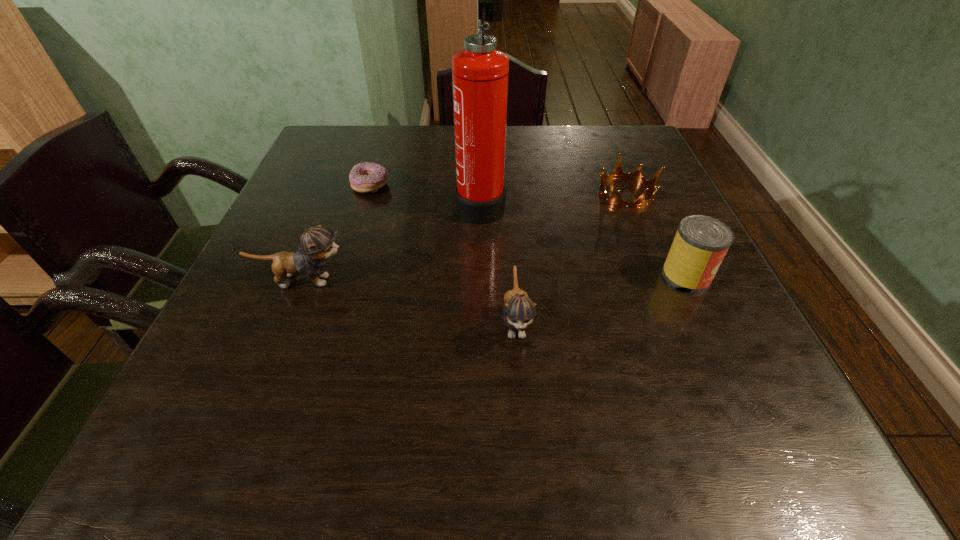
The width and height of the screenshot is (960, 540). Find the location of `vacant region located on the front-facing side of the tallest object`. vacant region located on the front-facing side of the tallest object is located at coordinates (396, 204).

Find the location of a particular element. Image resolution: width=960 pixels, height=540 pixels. free location located on the right of the shortest object is located at coordinates (492, 185).

Where is `vacant space located on the left of the can`? vacant space located on the left of the can is located at coordinates (638, 276).

The image size is (960, 540). What are the coordinates of `object that is positioned at the near edge` in the screenshot? It's located at (519, 310).

Where is `kitten at the left edge`? kitten at the left edge is located at coordinates (317, 244).

The width and height of the screenshot is (960, 540). Find the location of `doughnut positioned at the left edge`. doughnut positioned at the left edge is located at coordinates (365, 177).

You are a GUI agent. You are given a task and a screenshot of the screen. Output one action in this format:
    pyautogui.click(x=<x>, y=<y>)
    Task: Click on the crown located in the right edge section of the desktop
    The image size is (960, 540).
    Given the screenshot: What is the action you would take?
    pyautogui.click(x=617, y=200)

Locate an element on the screen. This screenshot has width=960, height=540. can that is at the right edge is located at coordinates click(x=701, y=242).

You are a GUI agent. You are given a task and a screenshot of the screen. Output one action in this format:
    pyautogui.click(x=<x>, y=<y>)
    Task: Click on the vacant space at the far edge
    Image resolution: width=960 pixels, height=540 pixels.
    Given the screenshot: What is the action you would take?
    pyautogui.click(x=528, y=127)

The height and width of the screenshot is (540, 960). In order to click on free space at the near edge of the desktop in this screenshot , I will do (x=489, y=354).